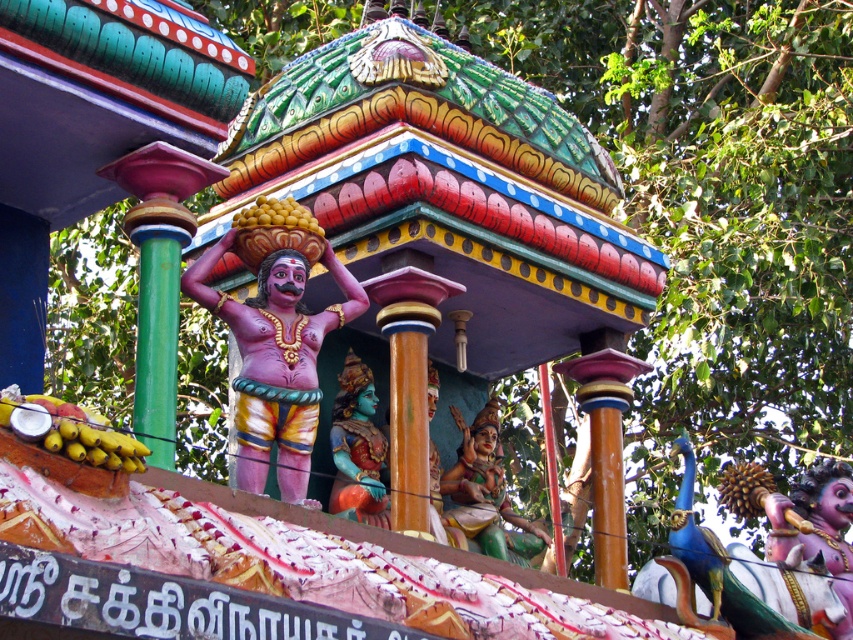
Question: Does polished gold statue at upper right appear under saffron-colored textured fruit at center?

Choices:
 (A) yes
 (B) no

Answer: (B)

Question: Which object is farther from the camera taking this photo?

Choices:
 (A) saffron-colored textured fruit at center
 (B) yellow matte bananas at lower left

Answer: (A)

Question: Is green painted statue at center to the right of saffron-colored textured fruit at center from the viewer's perspective?

Choices:
 (A) no
 (B) yes

Answer: (A)

Question: Observing the image, what is the correct spatial positioning of green painted statue at center in reference to teal painted statue at center?

Choices:
 (A) right
 (B) left

Answer: (A)

Question: Which point is closer to the camera?

Choices:
 (A) (216, 314)
 (B) (808, 570)
 (C) (495, 419)
 (D) (811, 506)

Answer: (A)

Question: Which of these objects is positioned closest to the saffron-colored textured fruit at center?

Choices:
 (A) teal painted statue at center
 (B) yellow matte bananas at center
 (C) yellow matte bananas at lower left
 (D) green painted statue at center

Answer: (D)